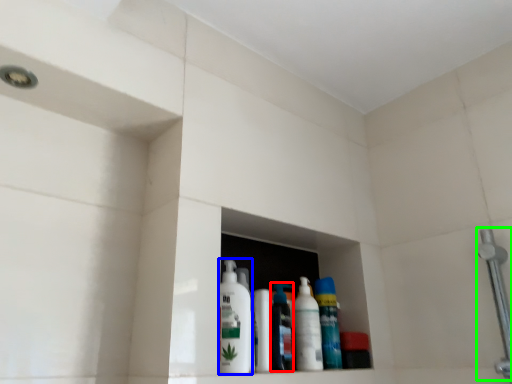
Question: Considering the real-world distances, which object is farthest from cleaning product (highlighted by a red box)? cleaning product (highlighted by a blue box) or shower (highlighted by a green box)?

Choices:
 (A) cleaning product
 (B) shower

Answer: (B)